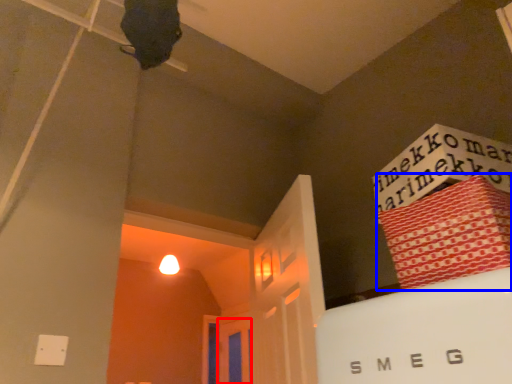
Question: Which object is further to the camera taking this photo, door (highlighted by a red box) or bundle (highlighted by a blue box)?

Choices:
 (A) door
 (B) bundle

Answer: (A)